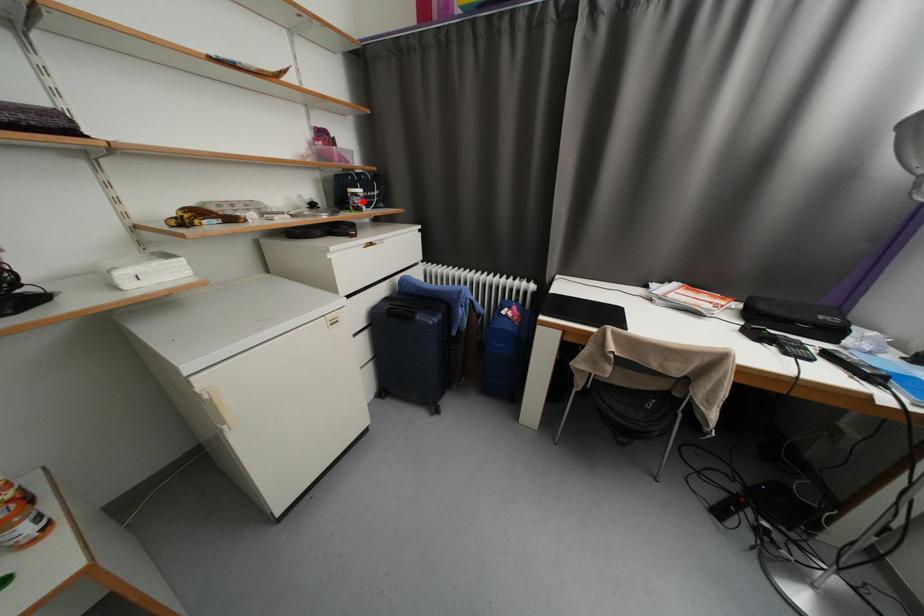
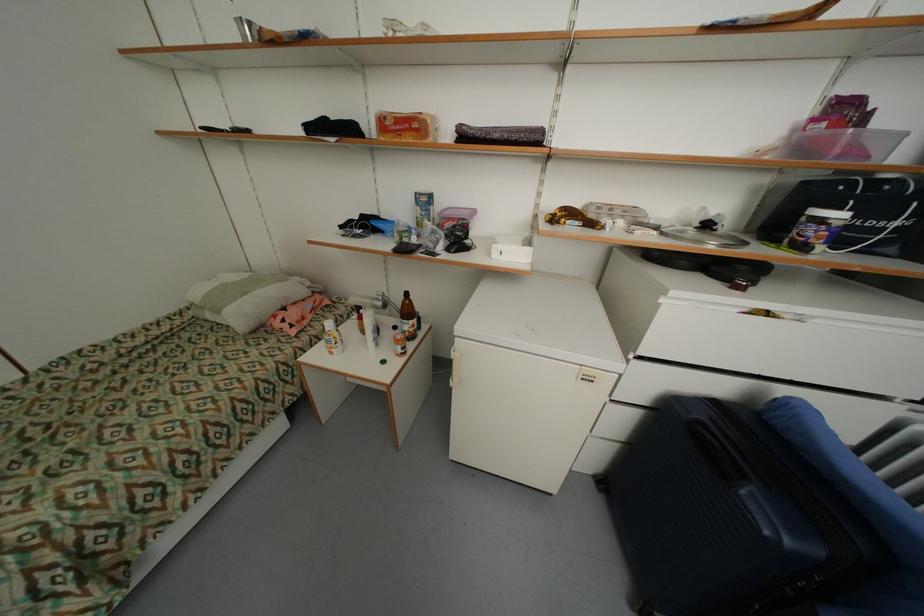
Question: I am providing you with two images of the same scene from different viewpoints. Image1 has a red point marked. In image2, the corresponding 3D location appears at what relative position? Reply with the corresponding letter.

Choices:
 (A) Closer
 (B) Farther

Answer: (B)